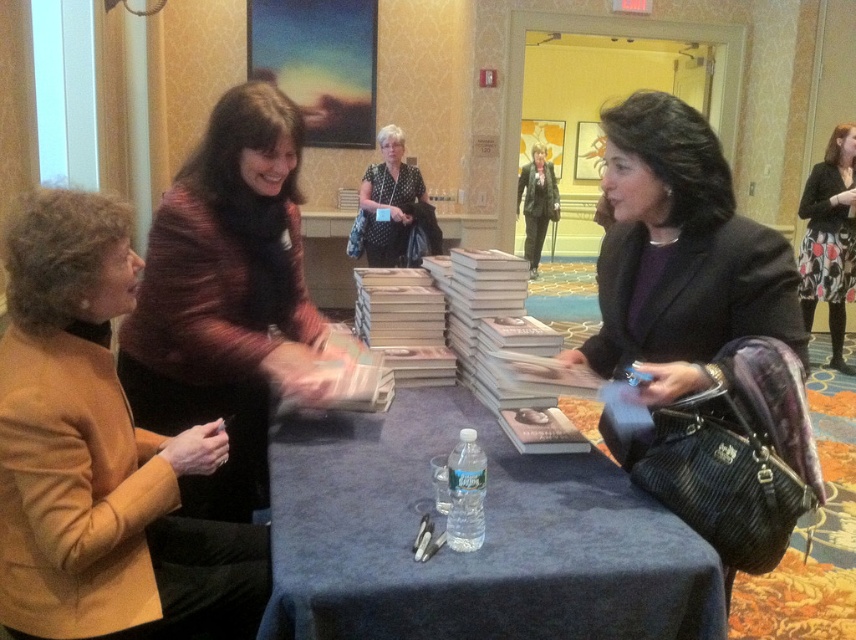
From the picture: You are organizing a book signing event and need to ensure that the blue fabric table at center can accommodate the striped wool sweater at center. Based on their sizes, will the sweater fit on the table?

The blue fabric table at center has a smaller size compared to striped wool sweater at center, so the sweater will not fit on the table.